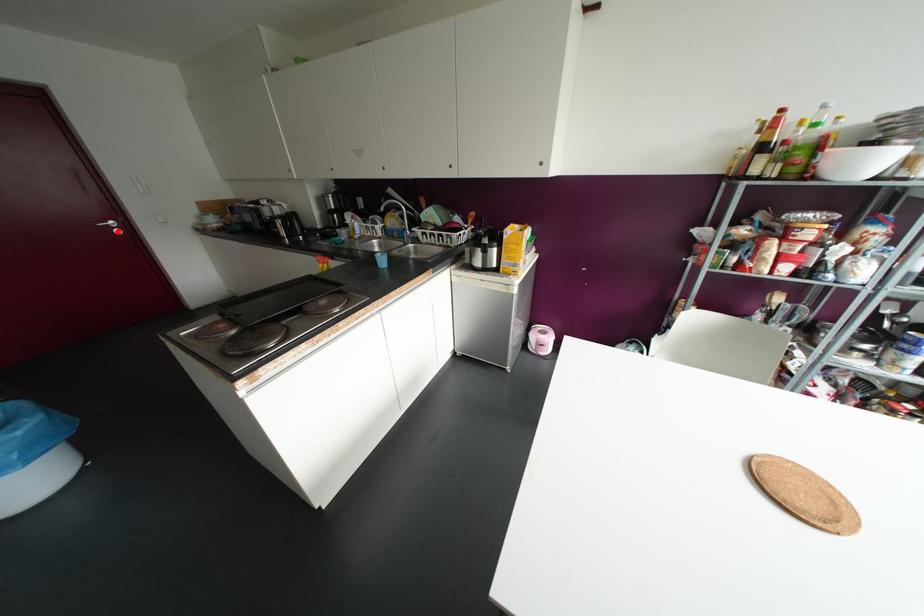
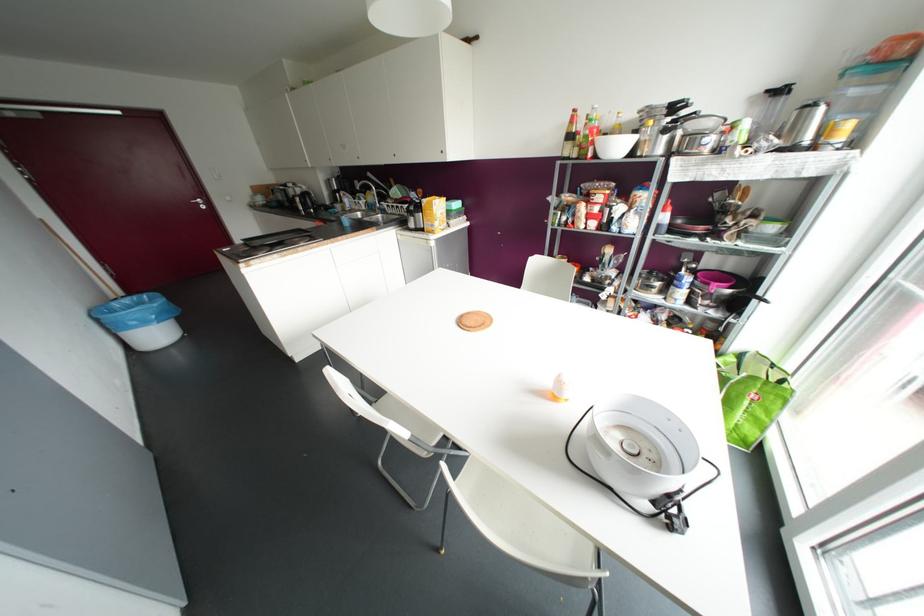
Where in the second image is the point corresponding to the highlighted location from the first image?

(202, 207)